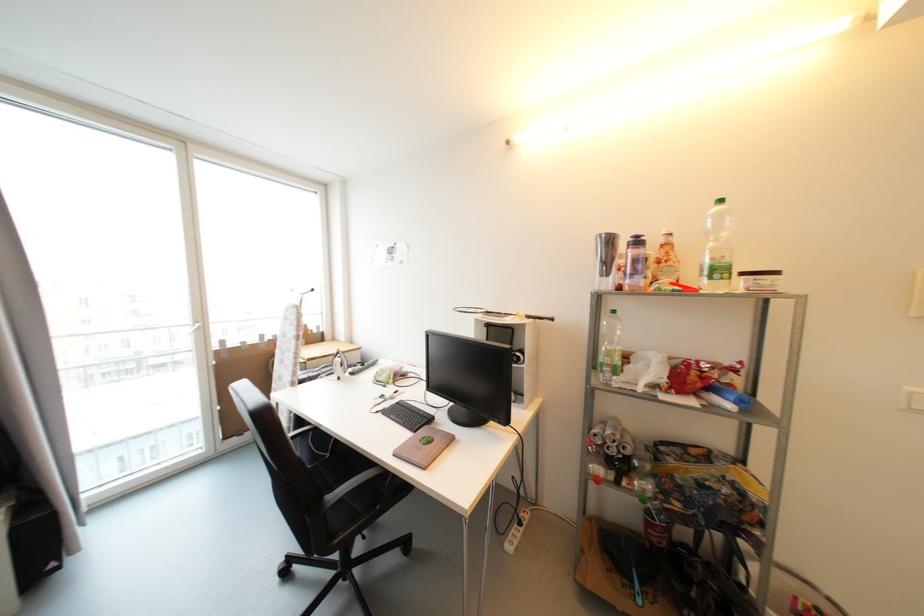
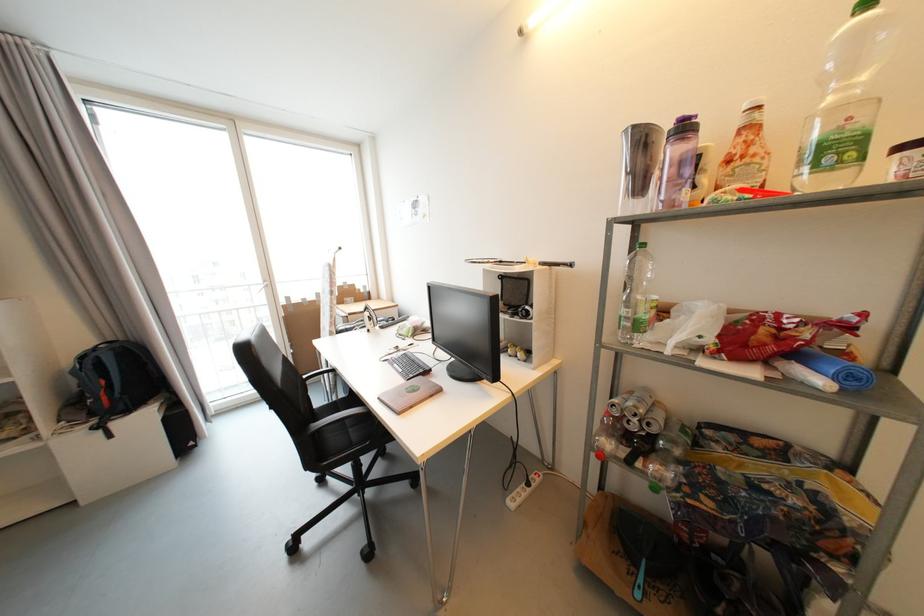
Find the pixel in the second image that matches point (718, 391) in the first image.

(801, 357)